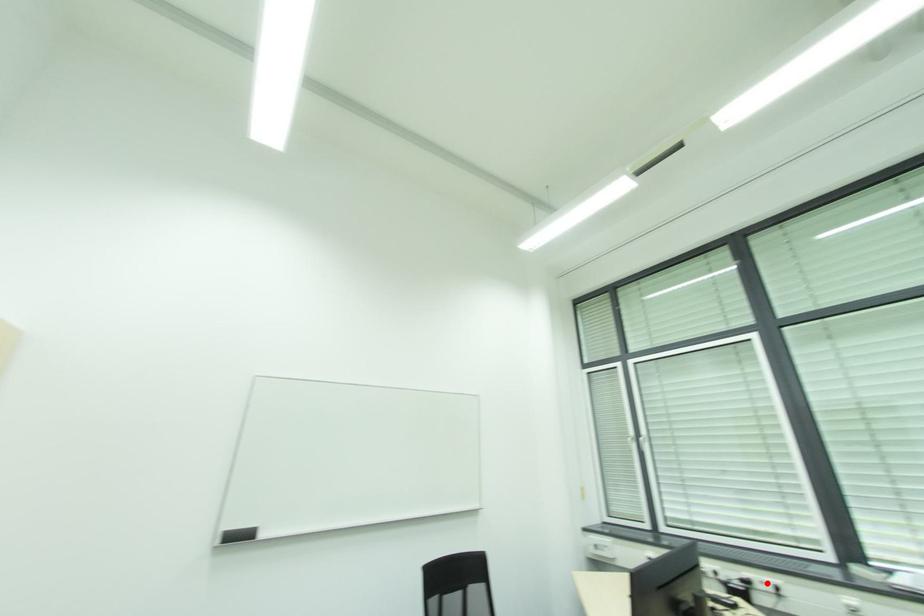
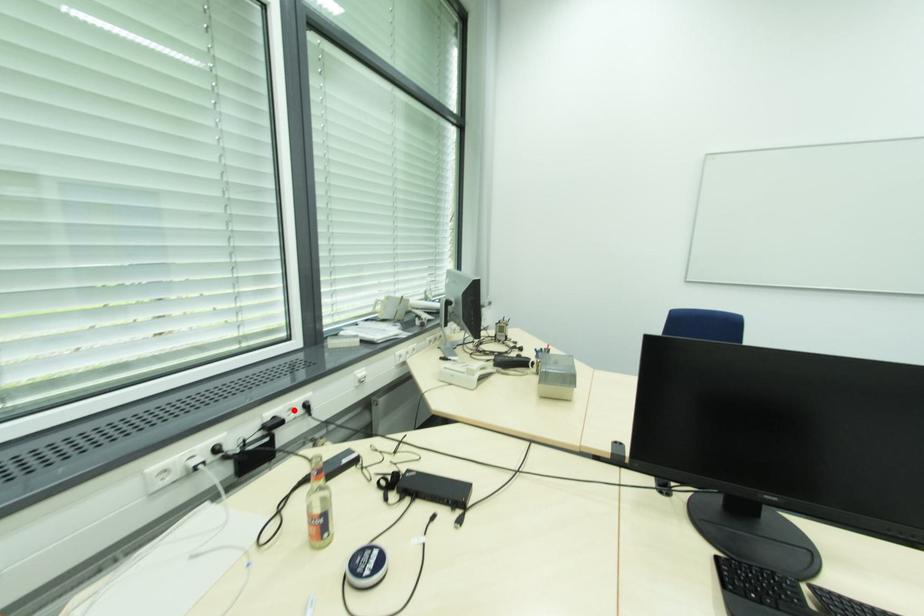
I am providing you with two images of the same scene from different viewpoints. A red point is marked on the first image and another point is marked on the second image. Do the highlighted points in image1 and image2 indicate the same real-world spot?

Yes